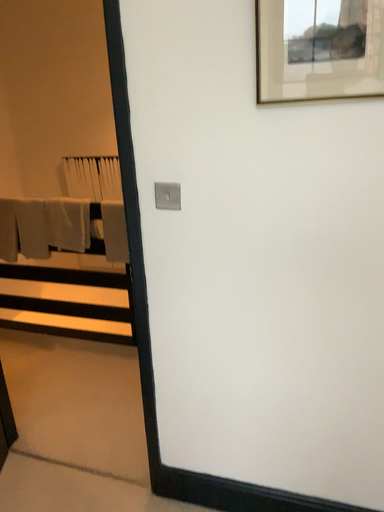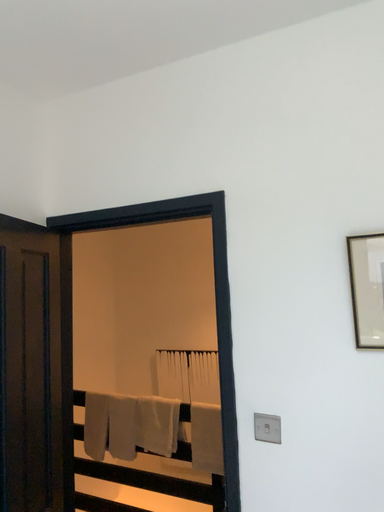
Question: How did the camera likely rotate when shooting the video?

Choices:
 (A) rotated downward
 (B) rotated upward

Answer: (B)